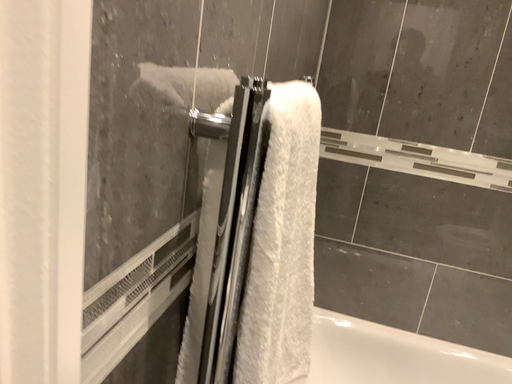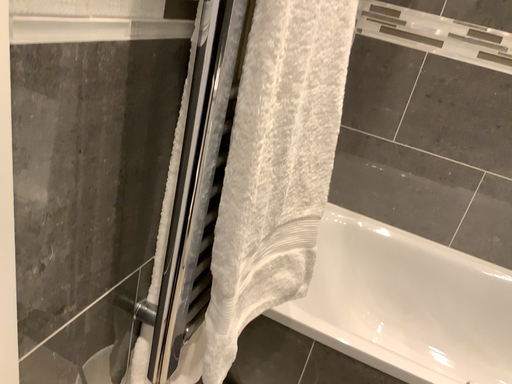
Question: Which way did the camera rotate in the video?

Choices:
 (A) rotated upward
 (B) rotated downward

Answer: (B)